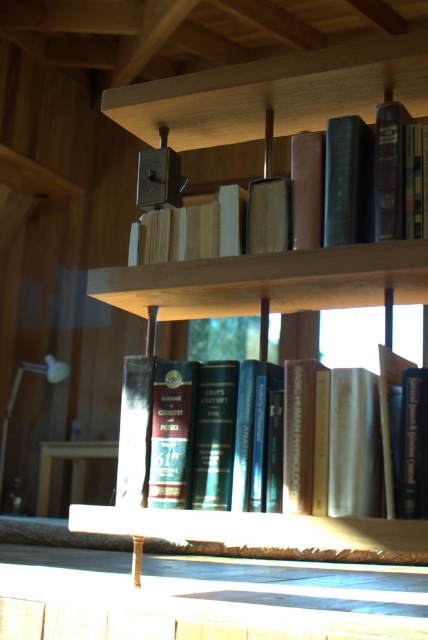
From the picture: You are standing in a cozy, rustic room and see a wooden bookcase at center. What is located at the coordinate point (275, 93)?

The wooden bookcase at center is located at the coordinate point (275, 93).

You are organizing books on the wooden bookshelf. You have two books to place next to each other. The first is a hardcover book at upper center and the second is hardcover books at center. Which book should you place to the left to maintain the current arrangement?

The hardcover book at upper center should be placed to the left of the hardcover books at center to maintain the current arrangement, as the hardcover books at center is positioned on the right side of the hardcover book at upper center.

You are a librarian trying to place a new book on the shelf. The book is 1.5 inches thick. You see the point at coordinates (137,426) on the bookshelf. Can you fit the new book at that point?

The point at coordinates (137,426) corresponds to hardcover books at center. Since the new book is 1.5 inches thick, it may not fit if the existing books are already tightly packed. However, without specific spacing information, it is uncertain. Please check the available space physically.